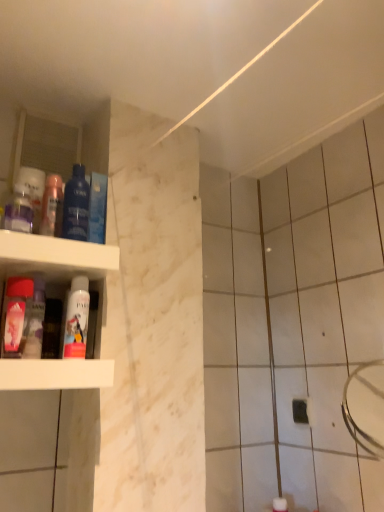
What do you see at coordinates (77, 319) in the screenshot? I see `pink matte spray can at lower left, the fifth mouthwash in the left-to-right sequence` at bounding box center [77, 319].

What do you see at coordinates (97, 208) in the screenshot? The height and width of the screenshot is (512, 384). I see `blue glossy mouthwash at upper left, which is the 6th mouthwash from left to right` at bounding box center [97, 208].

At what (x,y) coordinates should I click in order to perform the action: click on translucent plastic mouthwash at upper left, the third mouthwash positioned from the left. Please return your answer as a coordinate pair (x, y). This screenshot has height=512, width=384. Looking at the image, I should click on (51, 204).

How much space does translucent plastic mouthwash at upper left, the third mouthwash positioned from the left, occupy vertically?

Result: It is 6.70 inches.

In order to face translucent plastic mouthwash at left, placed as the 5th mouthwash when sorted from right to left, should I rotate leftwards or rightwards?

Rotate your view left by about 20.239°.

Where is `blue glossy mouthwash at left, the third mouthwash in the right-to-left sequence`? The image size is (384, 512). blue glossy mouthwash at left, the third mouthwash in the right-to-left sequence is located at coordinates (76, 205).

From a real-world perspective, is pink matte spray can at lower left, acting as the 2th mouthwash starting from the right, physically located above or below translucent plastic mouthwash at upper left, the third mouthwash positioned from the left?

pink matte spray can at lower left, acting as the 2th mouthwash starting from the right, is situated lower than translucent plastic mouthwash at upper left, the third mouthwash positioned from the left, in the real world.

Is pink matte spray can at lower left, acting as the 2th mouthwash starting from the right, facing towards translucent plastic mouthwash at upper left, the third mouthwash positioned from the left?

No, pink matte spray can at lower left, acting as the 2th mouthwash starting from the right, does not turn towards translucent plastic mouthwash at upper left, the third mouthwash positioned from the left.

What's the angular difference between pink matte spray can at lower left, the fifth mouthwash in the left-to-right sequence, and translucent plastic mouthwash at upper left, placed as the fourth mouthwash when sorted from right to left,'s facing directions?

The angle between the facing direction of pink matte spray can at lower left, the fifth mouthwash in the left-to-right sequence, and the facing direction of translucent plastic mouthwash at upper left, placed as the fourth mouthwash when sorted from right to left, is 0.00199 degrees.

Is pink matte spray can at lower left, the fifth mouthwash in the left-to-right sequence, to the left of translucent plastic mouthwash at upper left, placed as the fourth mouthwash when sorted from right to left, from the viewer's perspective?

No, pink matte spray can at lower left, the fifth mouthwash in the left-to-right sequence, is not to the left of translucent plastic mouthwash at upper left, placed as the fourth mouthwash when sorted from right to left.

Is translucent plastic mouthwash at left, arranged as the second mouthwash when viewed from the left, aimed at blue glossy mouthwash at upper left, which is the 6th mouthwash from left to right?

No, translucent plastic mouthwash at left, arranged as the second mouthwash when viewed from the left, is not facing towards blue glossy mouthwash at upper left, which is the 6th mouthwash from left to right.

I want to click on the 4th mouthwash to the left when counting from the blue glossy mouthwash at upper left, the 1th mouthwash positioned from the right, so (x=36, y=322).

Does translucent plastic mouthwash at left, arranged as the second mouthwash when viewed from the left, contain blue glossy mouthwash at upper left, which is the 6th mouthwash from left to right?

No, blue glossy mouthwash at upper left, which is the 6th mouthwash from left to right, is located outside of translucent plastic mouthwash at left, arranged as the second mouthwash when viewed from the left.

Can you tell me how much translucent plastic mouthwash at left, placed as the 5th mouthwash when sorted from right to left, and blue glossy mouthwash at upper left, which is the 6th mouthwash from left to right, differ in facing direction?

translucent plastic mouthwash at left, placed as the 5th mouthwash when sorted from right to left, and blue glossy mouthwash at upper left, which is the 6th mouthwash from left to right, are facing 0.00103 degrees away from each other.

Consider the image. Does matte pink bottle at left have a greater width compared to matte plastic mouthwash at left, the first mouthwash viewed from the left?

Correct, the width of matte pink bottle at left exceeds that of matte plastic mouthwash at left, the first mouthwash viewed from the left.

Would you say matte pink bottle at left is to the left or to the right of matte plastic mouthwash at left, the 6th mouthwash positioned from the right, in the picture?

Clearly, matte pink bottle at left is on the right of matte plastic mouthwash at left, the 6th mouthwash positioned from the right, in the image.

How many degrees apart are the facing directions of matte pink bottle at left and matte plastic mouthwash at left, the first mouthwash viewed from the left?

There is a 0.000519-degree angle between the facing directions of matte pink bottle at left and matte plastic mouthwash at left, the first mouthwash viewed from the left.

Who is bigger, matte pink bottle at left or matte plastic mouthwash at left, the 6th mouthwash positioned from the right?

matte pink bottle at left.

Could you tell me if white plastic shelf at left is turned towards translucent plastic mouthwash at left, placed as the 5th mouthwash when sorted from right to left?

Yes, white plastic shelf at left is oriented towards translucent plastic mouthwash at left, placed as the 5th mouthwash when sorted from right to left.

From the image's perspective, does white plastic shelf at left appear lower than translucent plastic mouthwash at left, arranged as the second mouthwash when viewed from the left?

Yes, from the image's perspective, white plastic shelf at left is beneath translucent plastic mouthwash at left, arranged as the second mouthwash when viewed from the left.

Relative to translucent plastic mouthwash at left, placed as the 5th mouthwash when sorted from right to left, is white plastic shelf at left in front or behind?

Visually, white plastic shelf at left is located in front of translucent plastic mouthwash at left, placed as the 5th mouthwash when sorted from right to left.

The width and height of the screenshot is (384, 512). In the image, there is a translucent plastic mouthwash at left, arranged as the second mouthwash when viewed from the left. What are the coordinates of `shelf below it (from the image's perspective)` in the screenshot? It's located at (54, 256).

Consider the image. Would you say blue glossy mouthwash at upper left, which is the 6th mouthwash from left to right, contains pink matte spray can at lower left, acting as the 2th mouthwash starting from the right?

No, pink matte spray can at lower left, acting as the 2th mouthwash starting from the right, is not inside blue glossy mouthwash at upper left, which is the 6th mouthwash from left to right.

Considering the relative positions of blue glossy mouthwash at upper left, which is the 6th mouthwash from left to right, and pink matte spray can at lower left, the fifth mouthwash in the left-to-right sequence, in the image provided, is blue glossy mouthwash at upper left, which is the 6th mouthwash from left to right, to the left or to the right of pink matte spray can at lower left, the fifth mouthwash in the left-to-right sequence,?

In the image, blue glossy mouthwash at upper left, which is the 6th mouthwash from left to right, appears on the right side of pink matte spray can at lower left, the fifth mouthwash in the left-to-right sequence.

Between blue glossy mouthwash at upper left, the 1th mouthwash positioned from the right, and pink matte spray can at lower left, acting as the 2th mouthwash starting from the right, which one has smaller size?

With smaller size is pink matte spray can at lower left, acting as the 2th mouthwash starting from the right.

Could you tell me if blue glossy mouthwash at upper left, which is the 6th mouthwash from left to right, is facing pink matte spray can at lower left, acting as the 2th mouthwash starting from the right?

No, blue glossy mouthwash at upper left, which is the 6th mouthwash from left to right, is not facing towards pink matte spray can at lower left, acting as the 2th mouthwash starting from the right.

Is translucent plastic mouthwash at left, placed as the 5th mouthwash when sorted from right to left, facing away from white plastic shelf at left?

Correct, translucent plastic mouthwash at left, placed as the 5th mouthwash when sorted from right to left, is looking away from white plastic shelf at left.

Between translucent plastic mouthwash at left, placed as the 5th mouthwash when sorted from right to left, and white plastic shelf at left, which one is positioned in front?

white plastic shelf at left.

From a real-world perspective, between translucent plastic mouthwash at left, placed as the 5th mouthwash when sorted from right to left, and white plastic shelf at left, who is vertically higher?

translucent plastic mouthwash at left, placed as the 5th mouthwash when sorted from right to left, is physically above.

Considering the positions of points (40, 348) and (55, 245), is point (40, 348) farther from camera compared to point (55, 245)?

Yes, point (40, 348) is farther from viewer.

From a real-world perspective, is matte pink bottle at left over white plastic shelf at left?

Yes, from a real-world perspective, matte pink bottle at left is over white plastic shelf at left

Who is taller, matte pink bottle at left or white plastic shelf at left?

white plastic shelf at left is taller.

Can we say matte pink bottle at left lies outside white plastic shelf at left?

No, matte pink bottle at left is not entirely external to white plastic shelf at left.

Can you see matte pink bottle at left touching white plastic shelf at left?

matte pink bottle at left and white plastic shelf at left are not in contact.

Where is `the 3rd mouthwash directly above the pink matte spray can at lower left, acting as the 2th mouthwash starting from the right (from a real-world perspective)`? Image resolution: width=384 pixels, height=512 pixels. the 3rd mouthwash directly above the pink matte spray can at lower left, acting as the 2th mouthwash starting from the right (from a real-world perspective) is located at coordinates (51, 204).

The height and width of the screenshot is (512, 384). I want to click on mouthwash that is the 4th one when counting rightward from the translucent plastic mouthwash at left, placed as the 5th mouthwash when sorted from right to left, so [x=97, y=208].

Based on their spatial positions, is white plastic shelf at left or translucent plastic mouthwash at left, arranged as the second mouthwash when viewed from the left, further from translucent plastic mouthwash at upper left, placed as the fourth mouthwash when sorted from right to left?

translucent plastic mouthwash at left, arranged as the second mouthwash when viewed from the left, is positioned further to the anchor translucent plastic mouthwash at upper left, placed as the fourth mouthwash when sorted from right to left.

Looking at the image, which one is located further to translucent plastic mouthwash at left, arranged as the second mouthwash when viewed from the left, pink matte spray can at lower left, acting as the 2th mouthwash starting from the right, or blue glossy mouthwash at upper left, the 1th mouthwash positioned from the right?

Among the two, blue glossy mouthwash at upper left, the 1th mouthwash positioned from the right, is located further to translucent plastic mouthwash at left, arranged as the second mouthwash when viewed from the left.

Looking at the image, which one is located closer to translucent plastic mouthwash at upper left, placed as the fourth mouthwash when sorted from right to left, translucent plastic mouthwash at left, arranged as the second mouthwash when viewed from the left, or blue glossy mouthwash at left, the third mouthwash in the right-to-left sequence?

Result: blue glossy mouthwash at left, the third mouthwash in the right-to-left sequence, lies closer to translucent plastic mouthwash at upper left, placed as the fourth mouthwash when sorted from right to left, than the other object.

Considering their positions, is blue glossy mouthwash at upper left, which is the 6th mouthwash from left to right, positioned closer to pink matte spray can at lower left, the fifth mouthwash in the left-to-right sequence, than translucent plastic mouthwash at upper left, placed as the fourth mouthwash when sorted from right to left?

The object closer to pink matte spray can at lower left, the fifth mouthwash in the left-to-right sequence, is translucent plastic mouthwash at upper left, placed as the fourth mouthwash when sorted from right to left.

Which object lies further to the anchor point white plastic shelf at left, translucent plastic mouthwash at upper left, the third mouthwash positioned from the left, or matte pink bottle at left?

matte pink bottle at left.

Considering their positions, is translucent plastic mouthwash at upper left, the third mouthwash positioned from the left, positioned further to translucent plastic mouthwash at left, placed as the 5th mouthwash when sorted from right to left, than matte plastic mouthwash at left, the 6th mouthwash positioned from the right?

The object further to translucent plastic mouthwash at left, placed as the 5th mouthwash when sorted from right to left, is matte plastic mouthwash at left, the 6th mouthwash positioned from the right.

Based on their spatial positions, is translucent plastic mouthwash at upper left, placed as the fourth mouthwash when sorted from right to left, or translucent plastic mouthwash at left, arranged as the second mouthwash when viewed from the left, further from blue glossy mouthwash at upper left, which is the 6th mouthwash from left to right?

Among the two, translucent plastic mouthwash at left, arranged as the second mouthwash when viewed from the left, is located further to blue glossy mouthwash at upper left, which is the 6th mouthwash from left to right.

Which object lies nearer to the anchor point pink matte spray can at lower left, acting as the 2th mouthwash starting from the right, matte plastic mouthwash at left, the first mouthwash viewed from the left, or blue glossy mouthwash at left, which ranks as the 4th mouthwash in left-to-right order?

blue glossy mouthwash at left, which ranks as the 4th mouthwash in left-to-right order.

In order to click on toiletry between white plastic shelf at left and translucent plastic mouthwash at left, arranged as the second mouthwash when viewed from the left, along the z-axis in this screenshot , I will do `click(16, 316)`.

At what (x,y) coordinates should I click in order to perform the action: click on toiletry that lies between blue glossy mouthwash at upper left, the 1th mouthwash positioned from the right, and white plastic shelf at left from top to bottom. Please return your answer as a coordinate pair (x, y). Looking at the image, I should click on (16, 316).

The image size is (384, 512). Find the location of `toiletry that lies between blue glossy mouthwash at left, which ranks as the 4th mouthwash in left-to-right order, and pink matte spray can at lower left, acting as the 2th mouthwash starting from the right, from top to bottom`. toiletry that lies between blue glossy mouthwash at left, which ranks as the 4th mouthwash in left-to-right order, and pink matte spray can at lower left, acting as the 2th mouthwash starting from the right, from top to bottom is located at coordinates (16, 316).

I want to click on toiletry between blue glossy mouthwash at upper left, the 1th mouthwash positioned from the right, and pink matte spray can at lower left, the fifth mouthwash in the left-to-right sequence, vertically, so click(x=16, y=316).